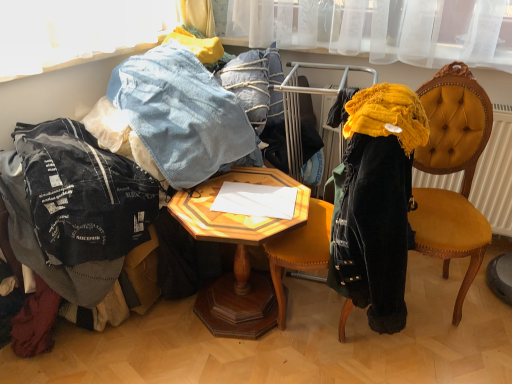
Question: Does ripped denim jacket at lower left turn towards denim at left?

Choices:
 (A) no
 (B) yes

Answer: (A)

Question: From a real-world perspective, is ripped denim jacket at lower left below denim at left?

Choices:
 (A) yes
 (B) no

Answer: (A)

Question: From the image's perspective, is ripped denim jacket at lower left beneath denim at left?

Choices:
 (A) no
 (B) yes

Answer: (B)

Question: Is ripped denim jacket at lower left thinner than denim at left?

Choices:
 (A) yes
 (B) no

Answer: (B)

Question: Would you say denim at left is part of ripped denim jacket at lower left's contents?

Choices:
 (A) yes
 (B) no

Answer: (B)

Question: From a real-world perspective, relative to velvet yellow chair at right, is denim at left vertically above or below?

Choices:
 (A) above
 (B) below

Answer: (A)

Question: Is denim at left inside or outside of velvet yellow chair at right?

Choices:
 (A) inside
 (B) outside

Answer: (B)

Question: From the image's perspective, is denim at left above or below velvet yellow chair at right?

Choices:
 (A) below
 (B) above

Answer: (B)

Question: From their relative heights in the image, would you say denim at left is taller or shorter than velvet yellow chair at right?

Choices:
 (A) tall
 (B) short

Answer: (B)

Question: Choose the correct answer: Is velvet yellow chair at right inside ripped denim jacket at lower left or outside it?

Choices:
 (A) inside
 (B) outside

Answer: (B)

Question: In terms of height, does velvet yellow chair at right look taller or shorter compared to ripped denim jacket at lower left?

Choices:
 (A) short
 (B) tall

Answer: (B)

Question: Is velvet yellow chair at right in front of or behind ripped denim jacket at lower left in the image?

Choices:
 (A) behind
 (B) front

Answer: (B)

Question: Is point pos(425,82) closer or farther from the camera than point pos(79,258)?

Choices:
 (A) farther
 (B) closer

Answer: (A)

Question: From a real-world perspective, relative to wooden hexagonal table at center, is denim at left vertically above or below?

Choices:
 (A) below
 (B) above

Answer: (B)

Question: Considering the positions of denim at left and wooden hexagonal table at center in the image, is denim at left wider or thinner than wooden hexagonal table at center?

Choices:
 (A) wide
 (B) thin

Answer: (A)